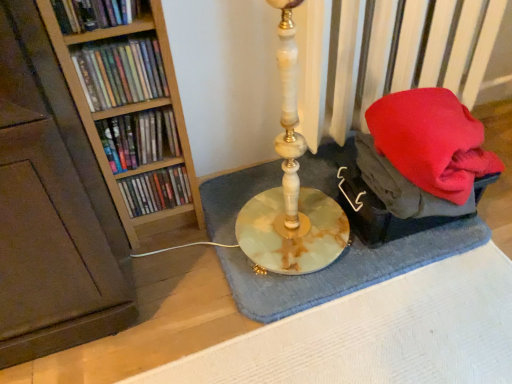
Question: Considering the relative sizes of matte plastic books at left, positioned as the first book in bottom-to-top order, and matte plastic books at left, positioned as the 3th book in top-to-bottom order, in the image provided, is matte plastic books at left, positioned as the first book in bottom-to-top order, bigger than matte plastic books at left, positioned as the 3th book in top-to-bottom order,?

Choices:
 (A) no
 (B) yes

Answer: (B)

Question: Is matte plastic books at left, the fourth book viewed from the top, facing towards matte plastic books at left, which is the second book from bottom to top?

Choices:
 (A) no
 (B) yes

Answer: (A)

Question: Is matte plastic books at left, the fourth book viewed from the top, positioned far away from matte plastic books at left, which is the second book from bottom to top?

Choices:
 (A) no
 (B) yes

Answer: (A)

Question: Does matte plastic books at left, positioned as the first book in bottom-to-top order, have a greater height compared to matte plastic books at left, which is the second book from bottom to top?

Choices:
 (A) yes
 (B) no

Answer: (A)

Question: Considering the relative sizes of matte plastic books at left, the fourth book viewed from the top, and matte plastic books at left, which is the second book from bottom to top, in the image provided, is matte plastic books at left, the fourth book viewed from the top, smaller than matte plastic books at left, which is the second book from bottom to top,?

Choices:
 (A) yes
 (B) no

Answer: (B)

Question: From the image's perspective, is matte plastic books at left, positioned as the first book in bottom-to-top order, located above or below matte plastic books at left, which is the second book from bottom to top?

Choices:
 (A) below
 (B) above

Answer: (A)

Question: Would you say matte plastic books at left, the fourth book viewed from the top, is inside or outside matte plastic books at left, which is the second book from bottom to top?

Choices:
 (A) outside
 (B) inside

Answer: (A)

Question: From a real-world perspective, is matte plastic books at left, the fourth book viewed from the top, above or below matte plastic books at left, which is the second book from bottom to top?

Choices:
 (A) above
 (B) below

Answer: (B)

Question: Is matte plastic books at left, positioned as the first book in bottom-to-top order, wider or thinner than matte plastic books at left, which is the second book from bottom to top?

Choices:
 (A) thin
 (B) wide

Answer: (B)

Question: Is matte plastic book at upper left, marked as the first book in a top-to-bottom arrangement, wider or thinner than matte plastic books at left, positioned as the 3th book in top-to-bottom order?

Choices:
 (A) wide
 (B) thin

Answer: (B)

Question: Visually, is matte plastic book at upper left, marked as the first book in a top-to-bottom arrangement, positioned to the left or to the right of matte plastic books at left, which is the second book from bottom to top?

Choices:
 (A) left
 (B) right

Answer: (A)

Question: Would you say matte plastic book at upper left, the 4th book from the bottom, is inside or outside matte plastic books at left, positioned as the 3th book in top-to-bottom order?

Choices:
 (A) inside
 (B) outside

Answer: (B)

Question: From the image's perspective, is matte plastic book at upper left, the 4th book from the bottom, located above or below matte plastic books at left, positioned as the 3th book in top-to-bottom order?

Choices:
 (A) below
 (B) above

Answer: (B)

Question: Relative to matte plastic books at left, the fourth book viewed from the top, is blue textured bath mat at center in front or behind?

Choices:
 (A) behind
 (B) front

Answer: (B)

Question: From the image's perspective, is blue textured bath mat at center positioned above or below matte plastic books at left, positioned as the first book in bottom-to-top order?

Choices:
 (A) above
 (B) below

Answer: (B)